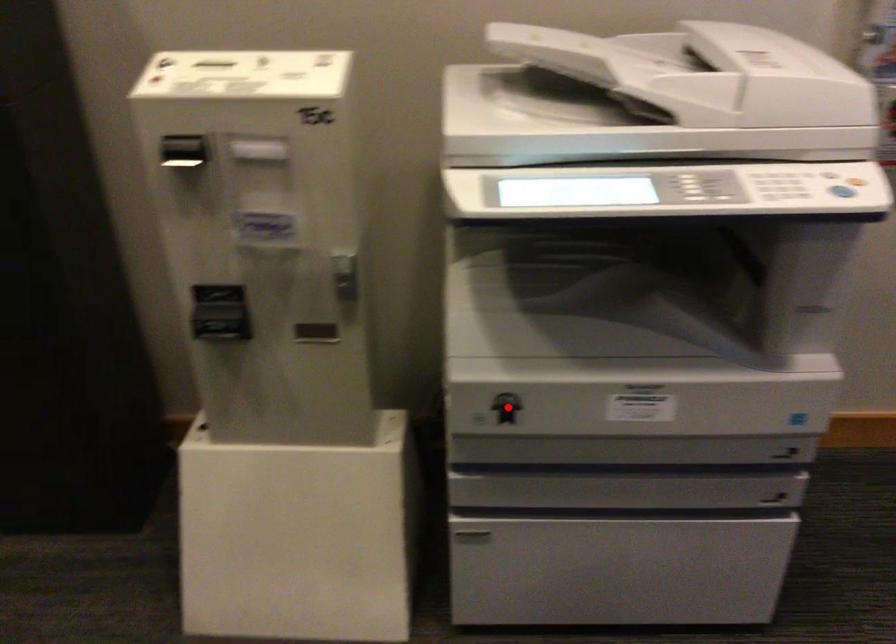
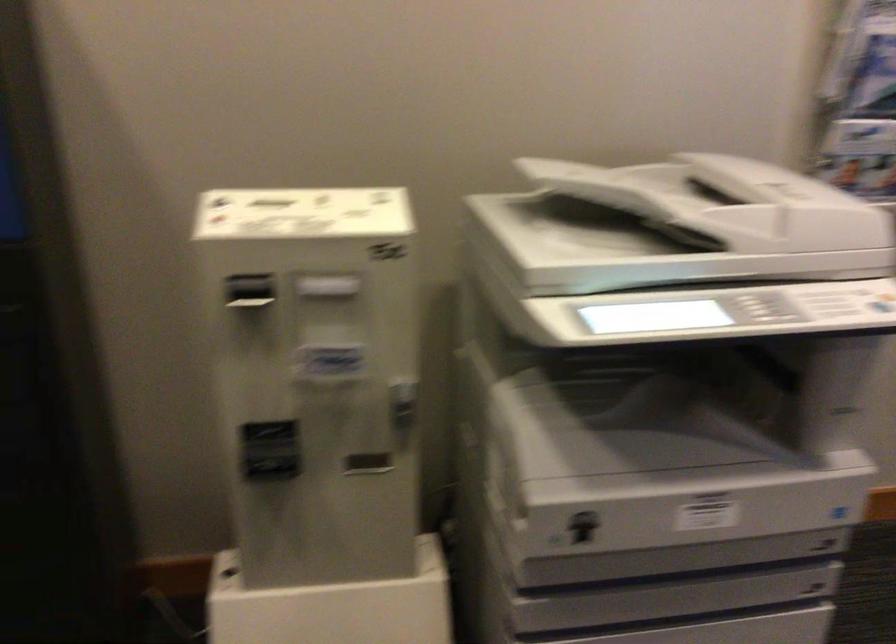
Locate, in the second image, the point that corresponds to the highlighted location in the first image.

(582, 526)